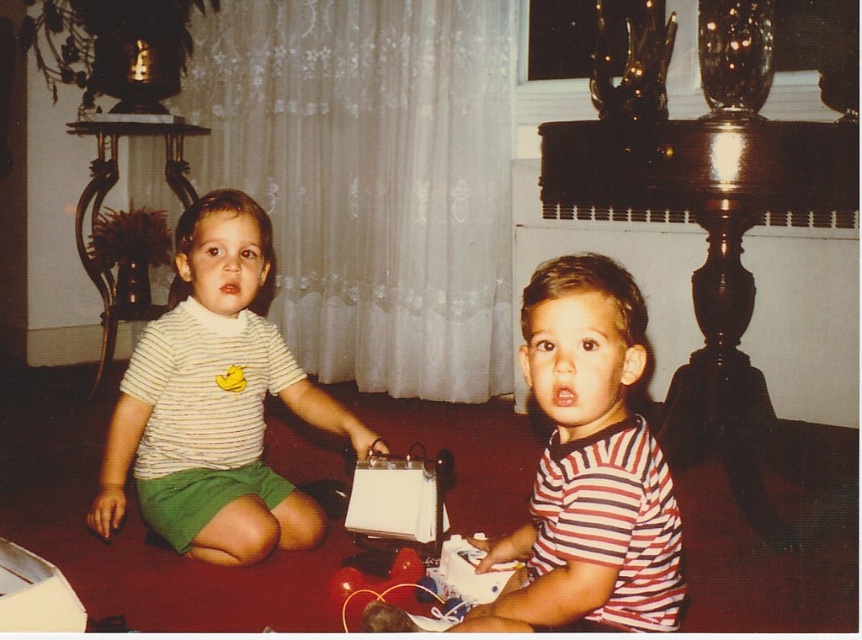
Question: Which of the following is the farthest from the observer?

Choices:
 (A) (391, 538)
 (B) (141, 384)

Answer: (B)

Question: Which point is farther from the camera taking this photo?

Choices:
 (A) (400, 480)
 (B) (272, 513)
 (C) (619, 556)

Answer: (B)

Question: Which point is farther to the camera?

Choices:
 (A) (236, 275)
 (B) (440, 499)

Answer: (B)

Question: Does matte striped shirt at center appear on the left side of white paper bag at center?

Choices:
 (A) yes
 (B) no

Answer: (A)

Question: Does matte striped shirt at center appear over striped cotton shirt at center?

Choices:
 (A) no
 (B) yes

Answer: (B)

Question: Can you confirm if striped cotton shirt at center is positioned to the left of white paper bag at center?

Choices:
 (A) yes
 (B) no

Answer: (B)